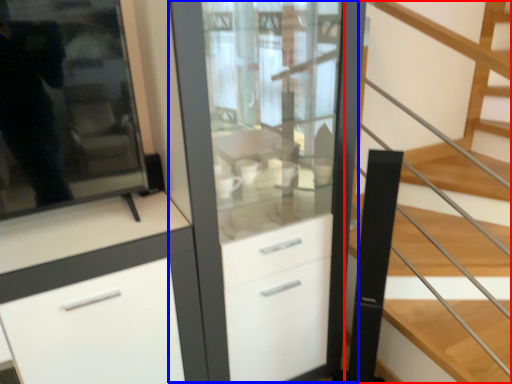
Question: Which of the following is the farthest to the observer, stairs (highlighted by a red box) or dresser (highlighted by a blue box)?

Choices:
 (A) stairs
 (B) dresser

Answer: (B)